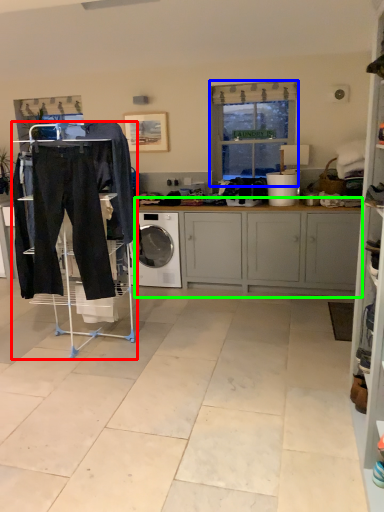
Question: Which object is positioned closest to shelf (highlighted by a red box)? Select from window (highlighted by a blue box) and cabinetry (highlighted by a green box).

Choices:
 (A) window
 (B) cabinetry

Answer: (B)